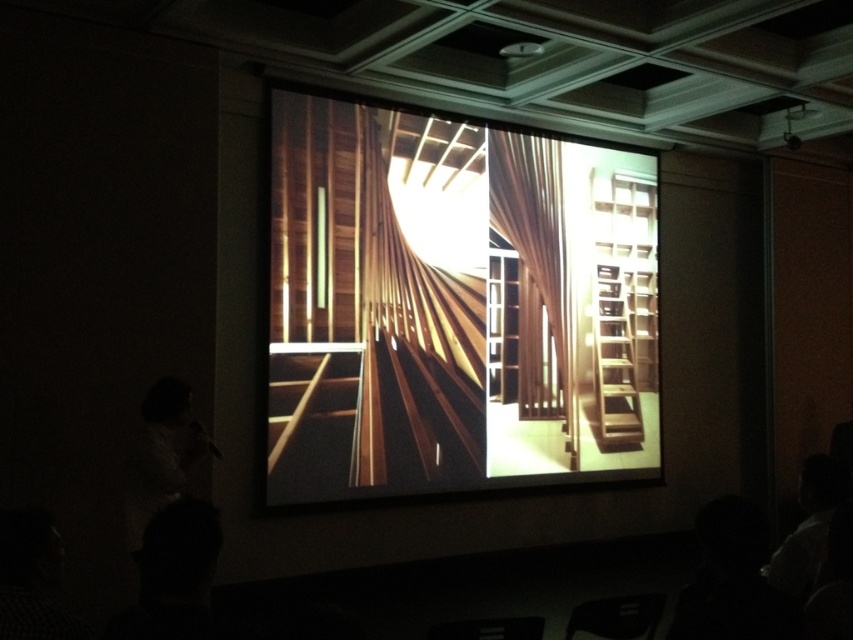
Between wooden stairs at center and wooden slats at center, which one appears on the left side from the viewer's perspective?

wooden slats at center

Who is shorter, wooden stairs at center or wooden slats at center?

wooden slats at center

The height and width of the screenshot is (640, 853). Find the location of `wooden stairs at center`. wooden stairs at center is located at coordinates (454, 307).

Between wooden slats at center and wooden at center, which one appears on the right side from the viewer's perspective?

Positioned to the right is wooden at center.

Looking at this image, can you confirm if wooden slats at center is positioned below wooden at center?

No, wooden slats at center is not below wooden at center.

Describe the element at coordinates (413, 340) in the screenshot. The height and width of the screenshot is (640, 853). I see `wooden slats at center` at that location.

Where is `wooden slats at center`? This screenshot has height=640, width=853. wooden slats at center is located at coordinates (413, 340).

Who is shorter, wooden stairs at center or wooden at center?

wooden at center is shorter.

Can you confirm if wooden stairs at center is smaller than wooden at center?

Actually, wooden stairs at center might be larger than wooden at center.

Between point (590, 291) and point (529, 410), which one is positioned behind?

Point (590, 291)

Locate an element on the screen. This screenshot has height=640, width=853. wooden stairs at center is located at coordinates (454, 307).